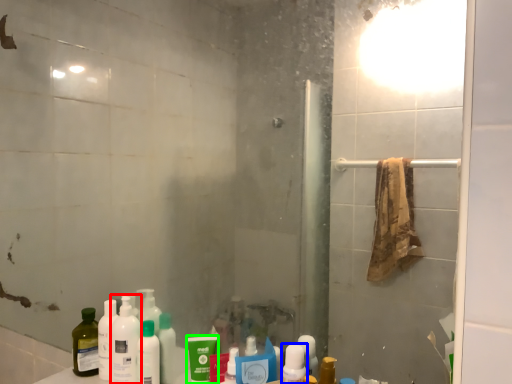
Question: Estimate the real-world distances between objects in this image. Which object is closer to cleaning product (highlighted by a red box), mouthwash (highlighted by a blue box) or mouthwash (highlighted by a green box)?

Choices:
 (A) mouthwash
 (B) mouthwash

Answer: (B)